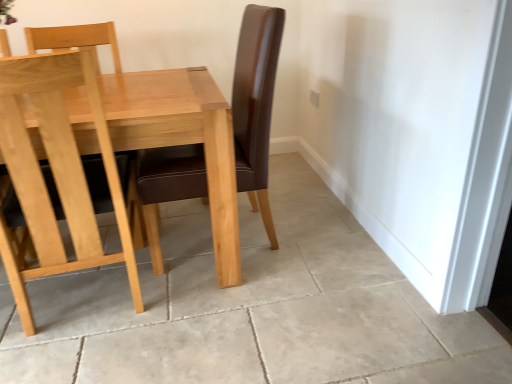
Image resolution: width=512 pixels, height=384 pixels. Find the location of `light gray tile floor at center`. light gray tile floor at center is located at coordinates (250, 308).

Are natural wood table at center and light gray tile floor at center located far from each other?

They are positioned close to each other.

Looking at the image, does natural wood table at center seem bigger or smaller compared to light gray tile floor at center?

Considering their sizes, natural wood table at center takes up more space than light gray tile floor at center.

Can we say natural wood table at center lies outside light gray tile floor at center?

Absolutely, natural wood table at center is external to light gray tile floor at center.

Considering the relative positions of light gray tile floor at center and light brown wood chair at left in the image provided, is light gray tile floor at center behind light brown wood chair at left?

No, it is not.

Would you say light gray tile floor at center is a long distance from light brown wood chair at left?

Actually, light gray tile floor at center and light brown wood chair at left are a little close together.

In the scene shown: Could you tell me if light gray tile floor at center is facing light brown wood chair at left?

No, light gray tile floor at center does not turn towards light brown wood chair at left.

Consider the image. Considering the relative positions of light gray tile floor at center and light brown wood chair at left in the image provided, is light gray tile floor at center to the left of light brown wood chair at left from the viewer's perspective?

Incorrect, light gray tile floor at center is not on the left side of light brown wood chair at left.

Is natural wood table at center touching light brown wood chair at left?

No, natural wood table at center is not making contact with light brown wood chair at left.

Does natural wood table at center have a lesser height compared to light brown wood chair at left?

Correct, natural wood table at center is not as tall as light brown wood chair at left.

Is natural wood table at center located outside light brown wood chair at left?

Absolutely, natural wood table at center is external to light brown wood chair at left.

From the picture: Is natural wood table at center bigger than light brown wood chair at left?

Yes, natural wood table at center is bigger than light brown wood chair at left.

Is point (101, 329) positioned behind point (188, 128)?

Yes, it is.

How many degrees apart are the facing directions of light gray tile floor at center and natural wood table at center?

light gray tile floor at center and natural wood table at center are facing 0.327 degrees away from each other.

In the image, is light gray tile floor at center positioned in front of or behind natural wood table at center?

In the image, light gray tile floor at center appears in front of natural wood table at center.

In the image, there is a light gray tile floor at center. Where is `table above it (from the image's perspective)`? The image size is (512, 384). table above it (from the image's perspective) is located at coordinates (182, 139).

Looking at this image, from a real-world perspective, is light brown wood chair at left above or below natural wood table at center?

In terms of real-world spatial position, light brown wood chair at left is above natural wood table at center.

Can you confirm if light brown wood chair at left is taller than natural wood table at center?

Yes.

How many degrees apart are the facing directions of light brown wood chair at left and natural wood table at center?

The facing directions of light brown wood chair at left and natural wood table at center are 180 degrees apart.

Locate an element on the screen. The image size is (512, 384). chair in front of the natural wood table at center is located at coordinates (58, 175).

Based on the photo, which of these two, light brown wood chair at left or light gray tile floor at center, stands taller?

With more height is light brown wood chair at left.

From the image's perspective, is light brown wood chair at left above or below light gray tile floor at center?

From the image's perspective, light brown wood chair at left appears above light gray tile floor at center.

Which is behind, point (20, 58) or point (246, 316)?

The point (246, 316) is behind.

Is light brown wood chair at left beside light gray tile floor at center?

light brown wood chair at left and light gray tile floor at center are clearly separated.

Find the location of a particular element. The height and width of the screenshot is (384, 512). table above the light gray tile floor at center (from a real-world perspective) is located at coordinates (182, 139).

Identify the location of chair on the left of light gray tile floor at center. (58, 175).

Based on their spatial positions, is light gray tile floor at center or natural wood table at center further from light brown wood chair at left?

light gray tile floor at center.

Consider the image. Looking at the image, which one is located further to light gray tile floor at center, light brown wood chair at left or natural wood table at center?

natural wood table at center is further to light gray tile floor at center.

Based on their spatial positions, is natural wood table at center or light gray tile floor at center further from light brown wood chair at left?

light gray tile floor at center is further to light brown wood chair at left.

Based on their spatial positions, is light brown wood chair at left or light gray tile floor at center closer to natural wood table at center?

light brown wood chair at left.

When comparing their distances from natural wood table at center, does light gray tile floor at center or light brown wood chair at left seem further?

light gray tile floor at center.

Looking at the image, which one is located further to light gray tile floor at center, natural wood table at center or light brown wood chair at left?

natural wood table at center lies further to light gray tile floor at center than the other object.

This screenshot has width=512, height=384. I want to click on chair situated between natural wood table at center and light gray tile floor at center from left to right, so click(58, 175).